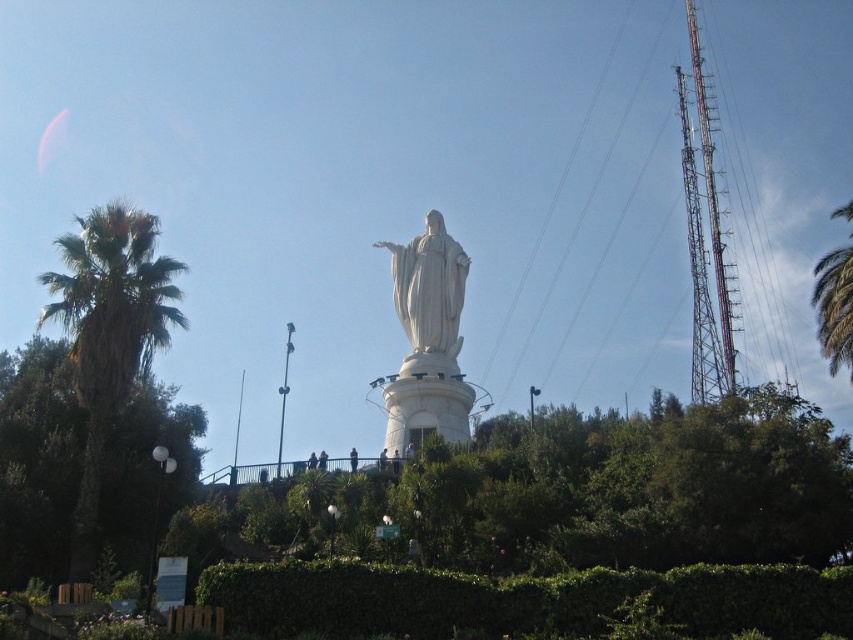
Question: Which of the following is the closest to the observer?

Choices:
 (A) green leafy tree at left
 (B) green leafy palm tree at right
 (C) green leafy tree at center

Answer: (C)

Question: Is green leafy tree at left thinner than green leafy palm tree at left?

Choices:
 (A) no
 (B) yes

Answer: (B)

Question: Estimate the real-world distances between objects in this image. Which object is farther from the green leafy palm tree at right?

Choices:
 (A) green leafy hedge at lower center
 (B) green leafy palm tree at left

Answer: (B)

Question: Does green leafy palm tree at left appear over clear plastic power lines at right?

Choices:
 (A) yes
 (B) no

Answer: (B)

Question: Which of the following is the closest to the observer?

Choices:
 (A) (477, 556)
 (B) (442, 292)

Answer: (A)

Question: Is green leafy hedge at lower center smaller than green leafy tree at left?

Choices:
 (A) yes
 (B) no

Answer: (A)